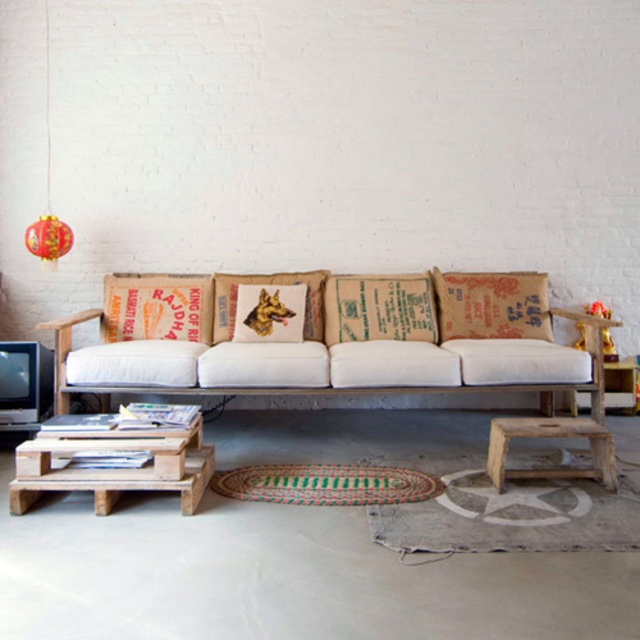
Does point (282, 284) come behind point (58, 237)?

Yes.

Does white fabric couch at center lie behind red paper lantern at upper left?

That is False.

Which is in front, point (413, 312) or point (45, 74)?

Point (413, 312) is in front.

The width and height of the screenshot is (640, 640). In order to click on white fabric couch at center in this screenshot , I will do `click(344, 340)`.

Who is shorter, wooden stool at lower right or red glossy paper lantern at upper left?

With less height is red glossy paper lantern at upper left.

How much distance is there between wooden stool at lower right and red glossy paper lantern at upper left?

They are 2.97 meters apart.

Which is behind, point (493, 484) or point (33, 224)?

Positioned behind is point (33, 224).

Image resolution: width=640 pixels, height=640 pixels. I want to click on wooden stool at lower right, so click(550, 436).

Is the position of brown burlap pillow at center more distant than that of wooden stool at lower right?

That is True.

Measure the distance between point (390, 291) and camera.

The distance of point (390, 291) from camera is 13.39 feet.

Where is `brown burlap pillow at center`? brown burlap pillow at center is located at coordinates (380, 307).